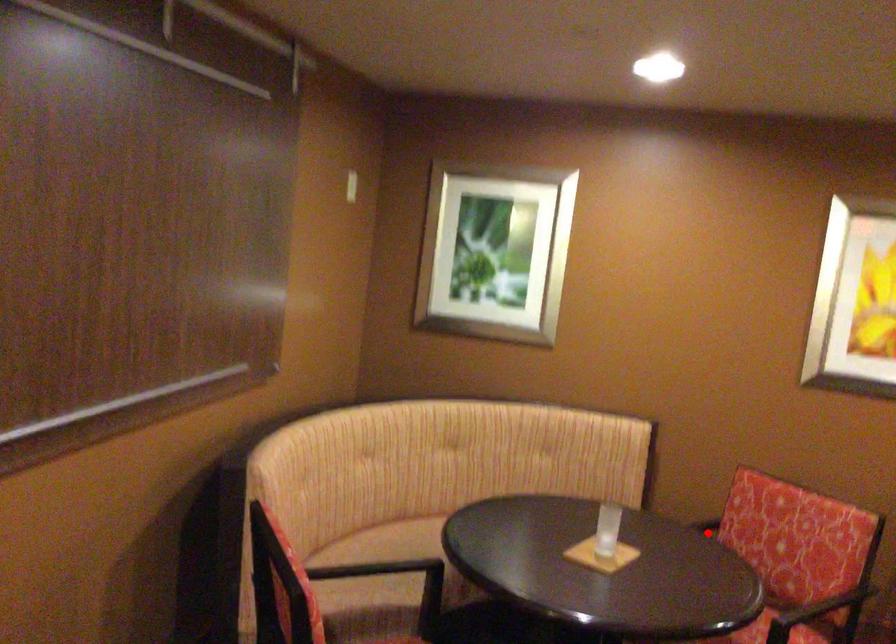
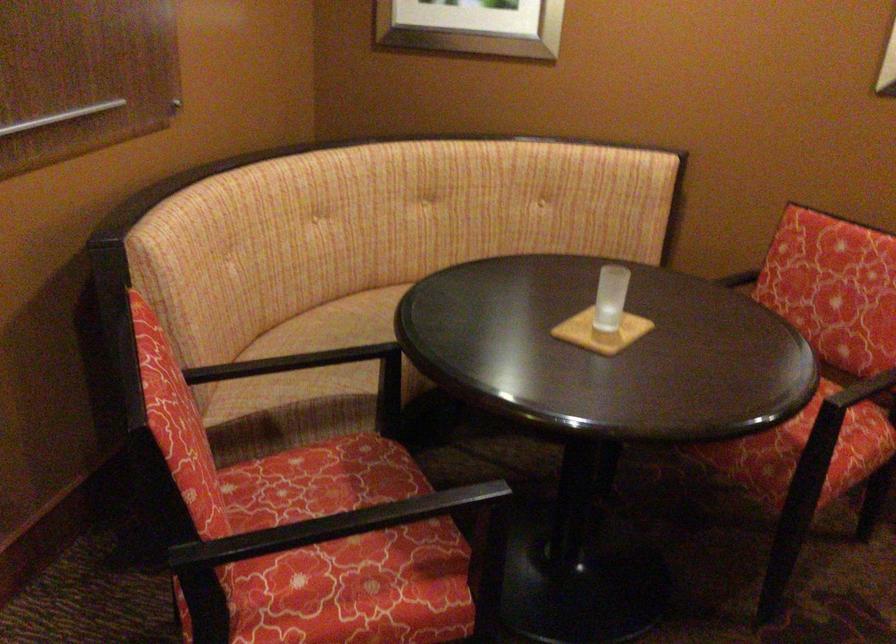
Question: I am providing you with two images of the same scene from different viewpoints. Image1 has a red point marked. In image2, the corresponding 3D location appears at what relative position? Reply with the corresponding letter.

Choices:
 (A) Closer
 (B) Farther

Answer: (A)